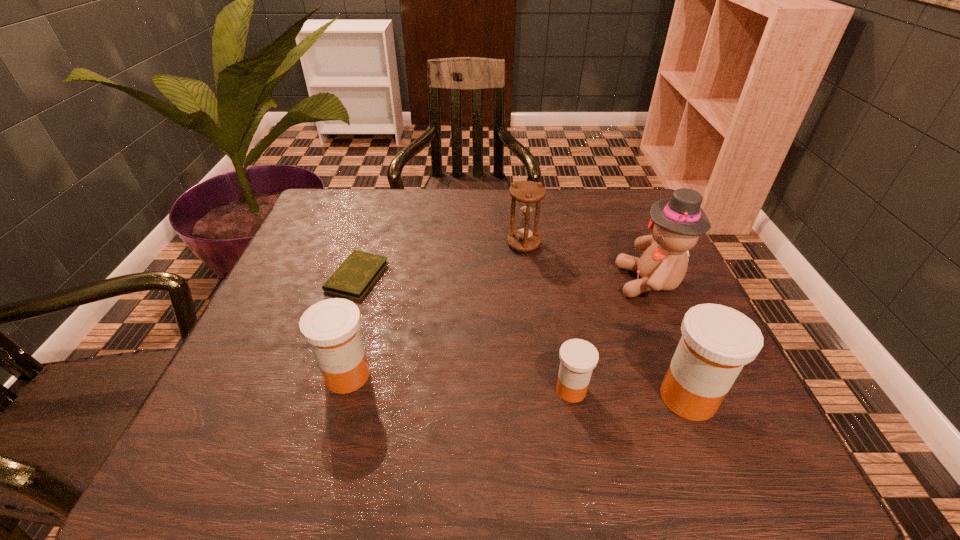
The width and height of the screenshot is (960, 540). I want to click on the third closest object relative to the farthest object, so click(x=578, y=358).

Locate an element on the screen. This screenshot has width=960, height=540. the second closest object relative to the second shortest medicine is located at coordinates (578, 358).

Find the location of a particular element. The width and height of the screenshot is (960, 540). the second closest medicine relative to the shortest object is located at coordinates (578, 358).

This screenshot has width=960, height=540. What are the coordinates of `the third closest medicine to the hourglass` in the screenshot? It's located at (331, 326).